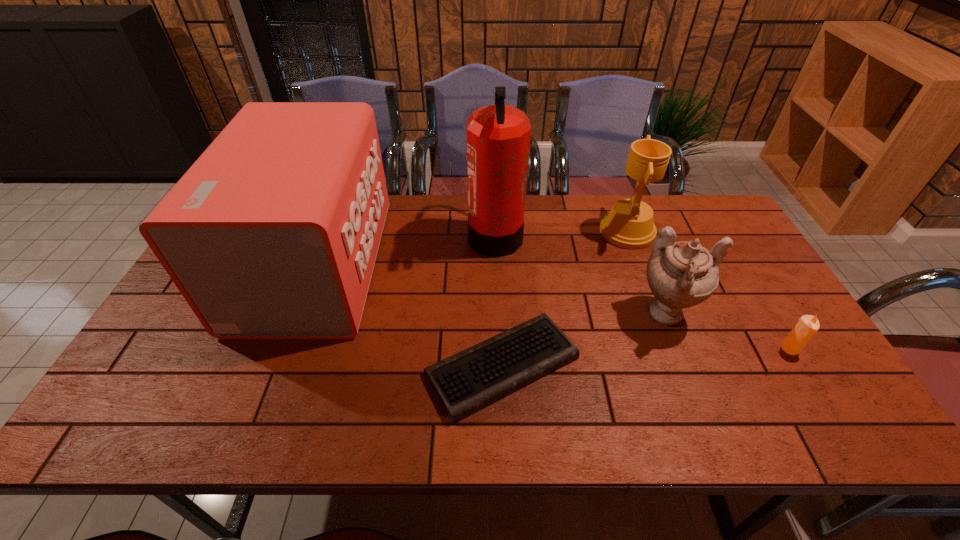
At what (x,y) coordinates should I click in order to perform the action: click on free space located 0.210m on the front side of the fire extinguisher. Please return your answer as a coordinate pair (x, y). Looking at the image, I should click on (403, 235).

Locate an element on the screen. This screenshot has width=960, height=540. vacant region located 0.180m on the surface of the second tallest object where the text is embossed is located at coordinates (441, 265).

The height and width of the screenshot is (540, 960). I want to click on vacant position located on the left of the award, so click(x=575, y=232).

I want to click on free location located on the right of the urn, so click(x=758, y=316).

At what (x,y) coordinates should I click in order to perform the action: click on free space located on the left of the second shortest object. Please return your answer as a coordinate pair (x, y). Looking at the image, I should click on (757, 348).

You are a GUI agent. You are given a task and a screenshot of the screen. Output one action in this format:
    pyautogui.click(x=<x>, y=<y>)
    Task: Click on the blank area located 0.190m on the right of the shortest object
    Image resolution: width=960 pixels, height=540 pixels.
    Given the screenshot: What is the action you would take?
    pyautogui.click(x=658, y=366)

The width and height of the screenshot is (960, 540). I want to click on fire extinguisher positioned at the far edge, so click(x=498, y=136).

Where is `box that is at the far edge`? The image size is (960, 540). box that is at the far edge is located at coordinates (273, 232).

Where is `award located at the far edge`? This screenshot has height=540, width=960. award located at the far edge is located at coordinates (629, 224).

The width and height of the screenshot is (960, 540). I want to click on object at the near edge, so click(x=466, y=382).